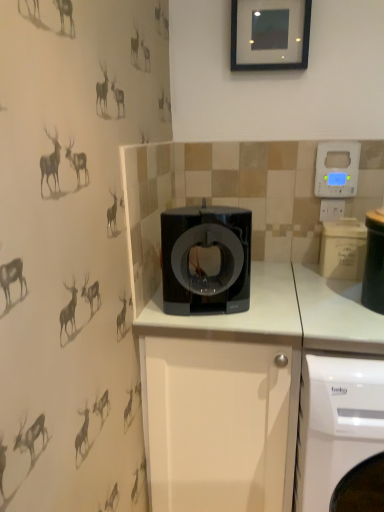
At what (x,y) coordinates should I click in order to perform the action: click on black glossy picture frame at upper center. Please return your answer as a coordinate pair (x, y). Looking at the image, I should click on (270, 34).

Describe the element at coordinates (336, 423) in the screenshot. I see `white glossy washing machine at lower right` at that location.

Image resolution: width=384 pixels, height=512 pixels. What do you see at coordinates (374, 262) in the screenshot?
I see `black plastic container at right` at bounding box center [374, 262].

Locate an element on the screen. The height and width of the screenshot is (512, 384). black glossy picture frame at upper center is located at coordinates (270, 34).

In the scene shown: Is black plastic container at right completely or partially outside of black glossy coffee machine at center?

Absolutely, black plastic container at right is external to black glossy coffee machine at center.

Is black plastic container at right positioned far away from black glossy coffee machine at center?

No, black plastic container at right is not far from black glossy coffee machine at center.

Is black plastic container at right in front of or behind black glossy coffee machine at center in the image?

Visually, black plastic container at right is located in front of black glossy coffee machine at center.

Considering the relative positions of black plastic container at right and black glossy coffee machine at center in the image provided, is black plastic container at right to the left or to the right of black glossy coffee machine at center?

From the image, it's evident that black plastic container at right is to the right of black glossy coffee machine at center.

Is black glossy picture frame at upper center facing towards black plastic container at right?

No, black glossy picture frame at upper center is not facing towards black plastic container at right.

Is black glossy picture frame at upper center located outside black plastic container at right?

Yes.

Can you see black glossy picture frame at upper center touching black plastic container at right?

black glossy picture frame at upper center and black plastic container at right are not in contact.

Where is `appliance that is on the right side of black glossy picture frame at upper center`? The height and width of the screenshot is (512, 384). appliance that is on the right side of black glossy picture frame at upper center is located at coordinates [x=374, y=262].

The width and height of the screenshot is (384, 512). I want to click on thermostat that is above the white matte cabinet at center (from a real-world perspective), so click(x=337, y=170).

Measure the distance from white matte cabinet at center to blue plastic thermostat at upper right.

white matte cabinet at center and blue plastic thermostat at upper right are 32.06 inches apart from each other.

Is point (277, 444) more distant than point (319, 145)?

No, it is not.

Are white matte cabinet at center and blue plastic thermostat at upper right making contact?

No, white matte cabinet at center is not beside blue plastic thermostat at upper right.

Is there a large distance between white glossy washing machine at lower right and black glossy picture frame at upper center?

Indeed, white glossy washing machine at lower right is not near black glossy picture frame at upper center.

Which object is thinner, white glossy washing machine at lower right or black glossy picture frame at upper center?

Thinner between the two is black glossy picture frame at upper center.

Can you confirm if white glossy washing machine at lower right is bigger than black glossy picture frame at upper center?

Yes, white glossy washing machine at lower right is bigger than black glossy picture frame at upper center.

Can you confirm if white glossy washing machine at lower right is shorter than black glossy picture frame at upper center?

In fact, white glossy washing machine at lower right may be taller than black glossy picture frame at upper center.

Considering the sizes of objects black glossy picture frame at upper center and black glossy coffee machine at center in the image provided, who is smaller, black glossy picture frame at upper center or black glossy coffee machine at center?

Smaller between the two is black glossy picture frame at upper center.

Is the depth of black glossy picture frame at upper center greater than that of black glossy coffee machine at center?

Yes, it is.

Is black glossy picture frame at upper center positioned beyond the bounds of black glossy coffee machine at center?

Indeed, black glossy picture frame at upper center is completely outside black glossy coffee machine at center.

In the scene shown: Considering the positions of objects black glossy picture frame at upper center and black glossy coffee machine at center in the image provided, who is more to the right, black glossy picture frame at upper center or black glossy coffee machine at center?

Positioned to the right is black glossy picture frame at upper center.

Is black glossy coffee machine at center surrounding black plastic container at right?

Actually, black plastic container at right is outside black glossy coffee machine at center.

Is black glossy coffee machine at center at the left side of black plastic container at right?

Yes, black glossy coffee machine at center is to the left of black plastic container at right.

This screenshot has height=512, width=384. In the image, there is a black glossy coffee machine at center. In order to click on appliance below it (from a real-world perspective) in this screenshot , I will do `click(374, 262)`.

How distant is white plastic electric outlet at upper right from blue plastic thermostat at upper right?

white plastic electric outlet at upper right is 3.98 inches away from blue plastic thermostat at upper right.

At what (x,y) coordinates should I click in order to perform the action: click on thermostat located above the white plastic electric outlet at upper right (from the image's perspective). Please return your answer as a coordinate pair (x, y). Image resolution: width=384 pixels, height=512 pixels. Looking at the image, I should click on (337, 170).

From the picture: Is white plastic electric outlet at upper right directly adjacent to blue plastic thermostat at upper right?

No, white plastic electric outlet at upper right is not in contact with blue plastic thermostat at upper right.

Is white plastic electric outlet at upper right oriented towards blue plastic thermostat at upper right?

No, white plastic electric outlet at upper right is not facing towards blue plastic thermostat at upper right.

In order to click on home appliance to the left of black plastic container at right in this screenshot , I will do `click(206, 260)`.

Where is `appliance on the right of the black glossy picture frame at upper center`? The image size is (384, 512). appliance on the right of the black glossy picture frame at upper center is located at coordinates (374, 262).

Looking at the image, which one is located closer to blue plastic thermostat at upper right, black plastic container at right or white plastic electric outlet at upper right?

white plastic electric outlet at upper right is closer to blue plastic thermostat at upper right.

Which object lies nearer to the anchor point black glossy picture frame at upper center, white glossy washing machine at lower right or black glossy coffee machine at center?

black glossy coffee machine at center.

Which object lies further to the anchor point black glossy picture frame at upper center, blue plastic thermostat at upper right or white glossy washing machine at lower right?

white glossy washing machine at lower right is further to black glossy picture frame at upper center.

Estimate the real-world distances between objects in this image. Which object is closer to white matte cabinet at center, blue plastic thermostat at upper right or black plastic container at right?

black plastic container at right lies closer to white matte cabinet at center than the other object.

From the image, which object appears to be farther from black glossy picture frame at upper center, black plastic container at right or blue plastic thermostat at upper right?

black plastic container at right.

From the picture: When comparing their distances from blue plastic thermostat at upper right, does white plastic electric outlet at upper right or black glossy coffee machine at center seem further?

The object further to blue plastic thermostat at upper right is black glossy coffee machine at center.

From the image, which object appears to be farther from black glossy coffee machine at center, white glossy washing machine at lower right or black glossy picture frame at upper center?

Among the two, black glossy picture frame at upper center is located further to black glossy coffee machine at center.

Based on their spatial positions, is white plastic electric outlet at upper right or black glossy picture frame at upper center closer to blue plastic thermostat at upper right?

Among the two, white plastic electric outlet at upper right is located nearer to blue plastic thermostat at upper right.

You are a GUI agent. You are given a task and a screenshot of the screen. Output one action in this format:
    pyautogui.click(x=<x>, y=<y>)
    Task: Click on the cabinetry between black glossy coffee machine at center and white glossy washing machine at lower right in the vertical direction
    Image resolution: width=384 pixels, height=512 pixels.
    Given the screenshot: What is the action you would take?
    pyautogui.click(x=223, y=400)

Locate an element on the screen. The image size is (384, 512). cabinetry between blue plastic thermostat at upper right and white glossy washing machine at lower right vertically is located at coordinates (223, 400).

I want to click on appliance that lies between blue plastic thermostat at upper right and white glossy washing machine at lower right from top to bottom, so 374,262.

This screenshot has height=512, width=384. I want to click on electric outlet between black glossy picture frame at upper center and white matte cabinet at center in the up-down direction, so click(x=332, y=209).